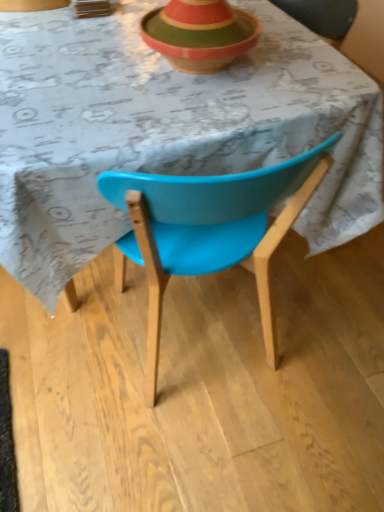
In order to click on wooden striped bowl at upper center in this screenshot , I will do `click(200, 33)`.

Describe the element at coordinates (200, 33) in the screenshot. I see `wooden striped bowl at upper center` at that location.

What do you see at coordinates (166, 130) in the screenshot?
I see `blue plastic chair at center` at bounding box center [166, 130].

At what (x,y) coordinates should I click in order to perform the action: click on blue plastic chair at center. Please return your answer as a coordinate pair (x, y). Looking at the image, I should click on (166, 130).

Identify the location of wooden striped bowl at upper center. (200, 33).

Considering the relative positions of wooden striped bowl at upper center and blue plastic chair at center in the image provided, is wooden striped bowl at upper center to the left or to the right of blue plastic chair at center?

wooden striped bowl at upper center is positioned on blue plastic chair at center's right side.

Based on the photo, in the image, is wooden striped bowl at upper center positioned in front of or behind blue plastic chair at center?

Visually, wooden striped bowl at upper center is located behind blue plastic chair at center.

Is point (144, 37) more distant than point (53, 66)?

Yes, point (144, 37) is behind point (53, 66).

From the image's perspective, would you say wooden striped bowl at upper center is shown under blue plastic chair at center?

No, from the image's perspective, wooden striped bowl at upper center is not below blue plastic chair at center.

From a real-world perspective, is wooden striped bowl at upper center positioned under blue plastic chair at center based on gravity?

Incorrect, from a real-world perspective, wooden striped bowl at upper center is higher than blue plastic chair at center.

Considering the sizes of objects wooden striped bowl at upper center and blue plastic chair at center in the image provided, who is wider, wooden striped bowl at upper center or blue plastic chair at center?

blue plastic chair at center.

Is wooden striped bowl at upper center shorter than blue plastic chair at center?

Yes.

From the picture: Which of these two, wooden striped bowl at upper center or blue plastic chair at center, is smaller?

With smaller size is wooden striped bowl at upper center.

Is wooden striped bowl at upper center spatially inside blue plastic chair at center, or outside of it?

wooden striped bowl at upper center is not enclosed by blue plastic chair at center.

Is wooden striped bowl at upper center far away from blue plastic chair at center?

No, wooden striped bowl at upper center is not far away from blue plastic chair at center.

Is wooden striped bowl at upper center turned away from blue plastic chair at center?

No, blue plastic chair at center is not at the back of wooden striped bowl at upper center.

How many degrees apart are the facing directions of wooden striped bowl at upper center and blue plastic chair at center?

They differ by 0.407 degrees in their facing directions.

Where is `table below the wooden striped bowl at upper center (from a real-world perspective)`? The image size is (384, 512). table below the wooden striped bowl at upper center (from a real-world perspective) is located at coordinates (166, 130).

Is blue plastic chair at center to the left of wooden striped bowl at upper center from the viewer's perspective?

Yes, blue plastic chair at center is to the left of wooden striped bowl at upper center.

Does blue plastic chair at center lie behind wooden striped bowl at upper center?

That is False.

Does point (246, 148) appear closer or farther from the camera than point (215, 13)?

Point (246, 148).

From the image's perspective, is blue plastic chair at center beneath wooden striped bowl at upper center?

Yes.

From a real-world perspective, which object stands above the other?

From a 3D spatial view, wooden striped bowl at upper center is above.

Which of these two, blue plastic chair at center or wooden striped bowl at upper center, is thinner?

With smaller width is wooden striped bowl at upper center.

Considering the relative sizes of blue plastic chair at center and wooden striped bowl at upper center in the image provided, is blue plastic chair at center taller than wooden striped bowl at upper center?

Yes.

Who is smaller, blue plastic chair at center or wooden striped bowl at upper center?

Smaller between the two is wooden striped bowl at upper center.

Consider the image. Would you say blue plastic chair at center is outside wooden striped bowl at upper center?

blue plastic chair at center is positioned outside wooden striped bowl at upper center.

Is blue plastic chair at center next to wooden striped bowl at upper center and touching it?

No, blue plastic chair at center is not next to wooden striped bowl at upper center.

Could you tell me if blue plastic chair at center is turned towards wooden striped bowl at upper center?

No, blue plastic chair at center is not oriented towards wooden striped bowl at upper center.

Locate an element on the screen. The image size is (384, 512). bowl to the right of blue plastic chair at center is located at coordinates (200, 33).

At what (x,y) coordinates should I click in order to perform the action: click on table in front of the wooden striped bowl at upper center. Please return your answer as a coordinate pair (x, y). Looking at the image, I should click on (166, 130).

Locate an element on the screen. Image resolution: width=384 pixels, height=512 pixels. bowl above the blue plastic chair at center (from a real-world perspective) is located at coordinates (200, 33).